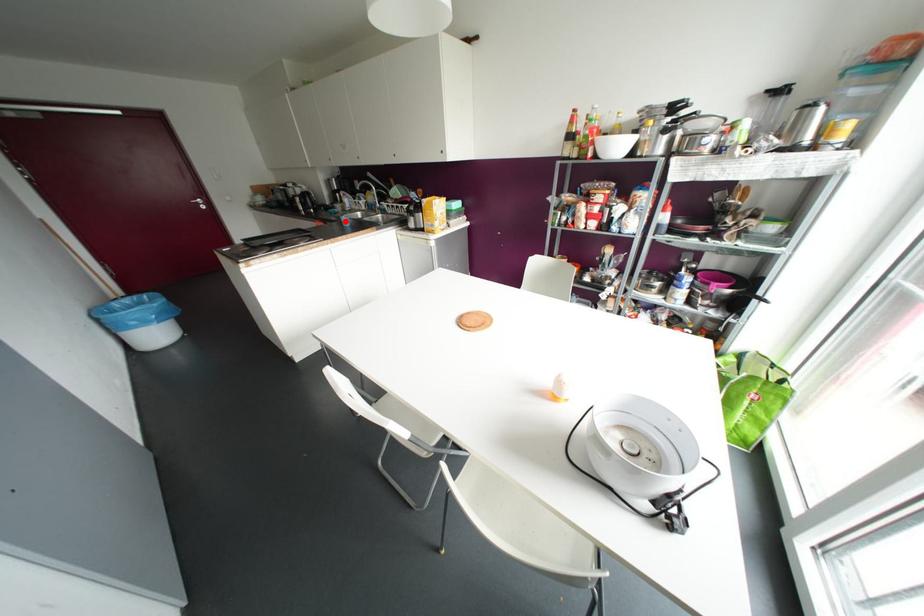
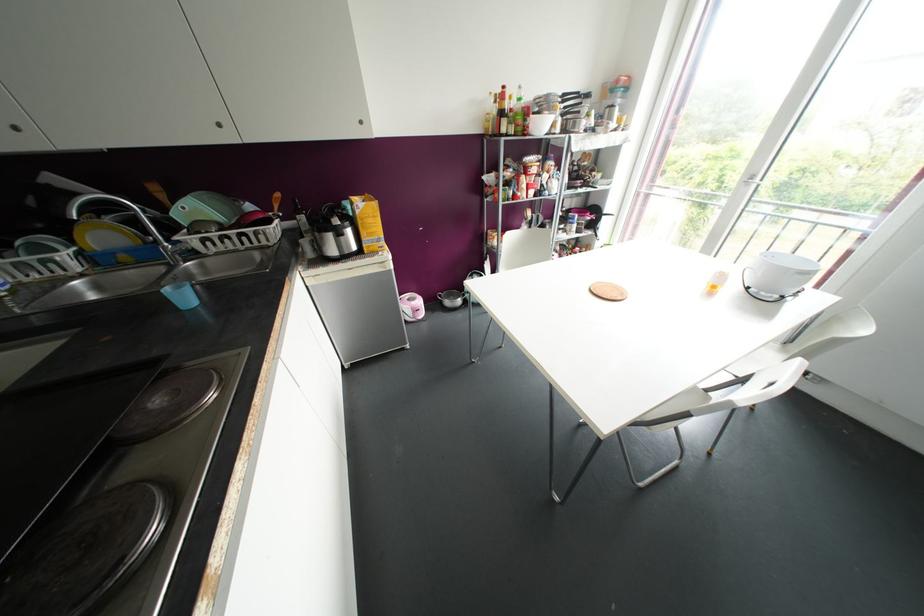
The point at the highlighted location is marked in the first image. Where is the corresponding point in the second image?

(184, 297)